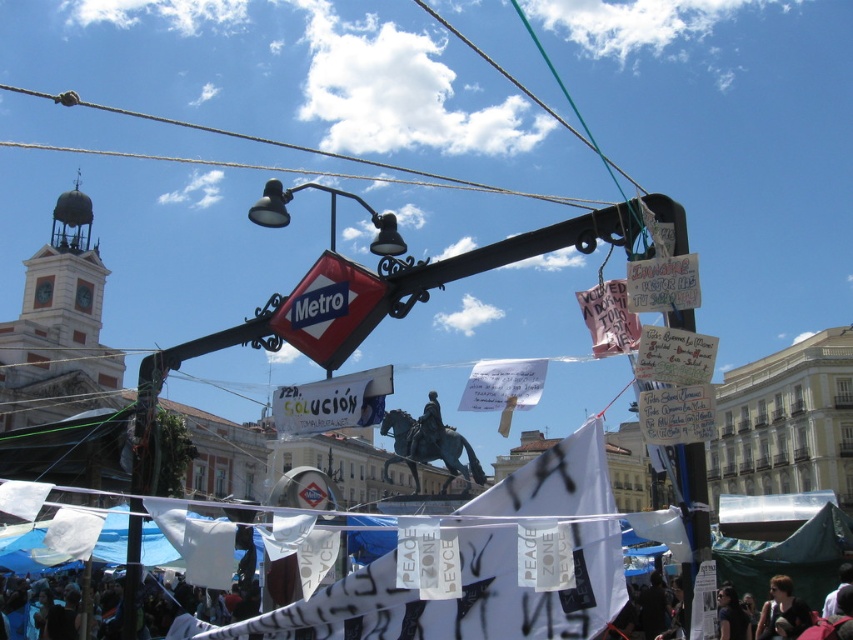
You are a photographer trying to capture the red plastic metro sign at center without any obstructions. From your current position, you notice the black fabric crowd at lower left. What should you do to ensure the sign is visible in your photo?

Move forward so that the black fabric crowd at lower left is no longer blocking the view of the red plastic metro sign at center, since the crowd is behind the sign and moving closer would reduce the obstruction.

You are a photographer trying to capture both the dark hair at lower right and the bronze statue of a man on horseback at center in a single frame. Based on their positions, which object should you adjust your camera to focus on first to ensure both are in the shot?

The dark hair at lower right is to the right of the bronze statue of a man on horseback at center. To include both in the frame, focus on the bronze statue of a man on horseback at center first, then adjust the camera to include the dark hair at lower right which is positioned to its right.